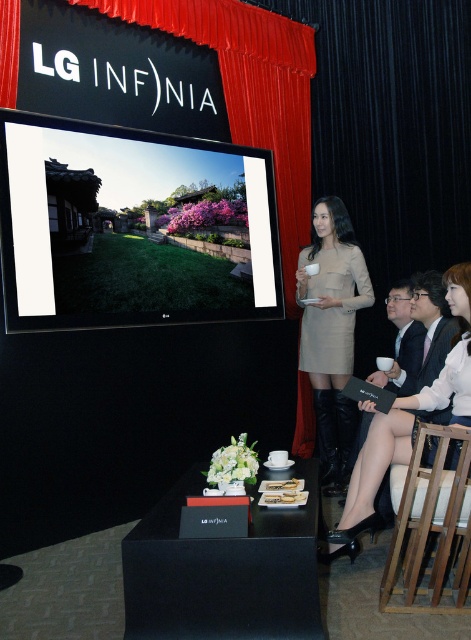
Does red velvet curtain at upper center have a lesser width compared to wooden at right?

No.

Which is more to the right, red velvet curtain at upper center or wooden at right?

wooden at right

Is point (279, 83) positioned behind point (453, 488)?

Yes, it is.

Find the location of a particular element. This screenshot has height=640, width=471. red velvet curtain at upper center is located at coordinates (251, 92).

Is red velvet curtain at upper center smaller than beige fabric dress at center?

Incorrect, red velvet curtain at upper center is not smaller in size than beige fabric dress at center.

Is point (15, 29) positioned before point (349, 285)?

Yes, it is.

You are a GUI agent. You are given a task and a screenshot of the screen. Output one action in this format:
    pyautogui.click(x=<x>, y=<y>)
    Task: Click on the red velvet curtain at upper center
    
    Given the screenshot: What is the action you would take?
    [251, 92]

Between matte black screen at upper left and red velvet curtain at upper center, which one appears on the left side from the viewer's perspective?

matte black screen at upper left

The width and height of the screenshot is (471, 640). Identify the location of matte black screen at upper left. (132, 227).